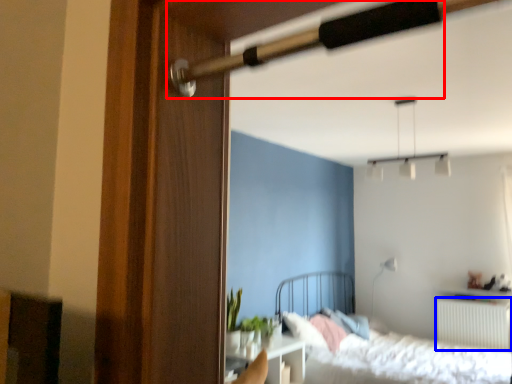
Question: Which object is closer to the camera taking this photo, door handle (highlighted by a red box) or radiator (highlighted by a blue box)?

Choices:
 (A) door handle
 (B) radiator

Answer: (A)